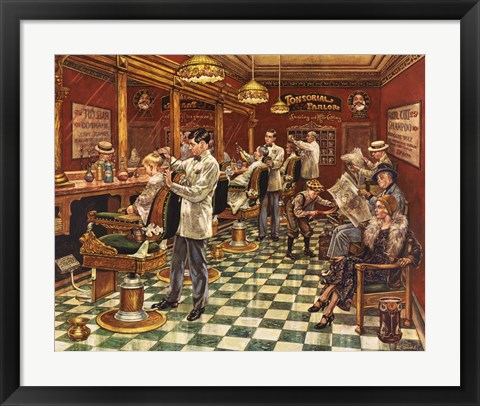
At what (x,y) coordinates should I click in order to perform the action: click on picture. Please return your answer as a coordinate pair (x, y). This screenshot has width=480, height=406. Looking at the image, I should click on (284, 110).